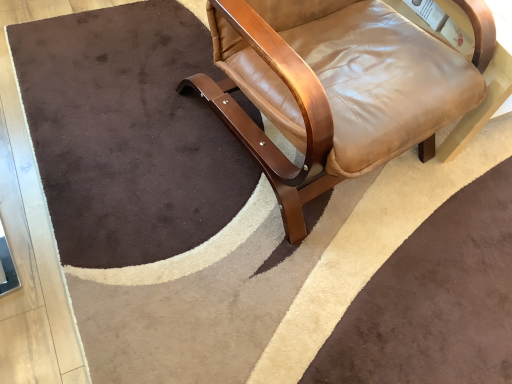
What are the coordinates of `leather at right` in the screenshot? It's located at (337, 86).

Measure the distance between leather at right and camera.

leather at right and camera are 35.02 inches apart from each other.

This screenshot has width=512, height=384. What do you see at coordinates (337, 86) in the screenshot?
I see `leather at right` at bounding box center [337, 86].

At what (x,y) coordinates should I click in order to perform the action: click on leather at right. Please return your answer as a coordinate pair (x, y). The image size is (512, 384). Looking at the image, I should click on (337, 86).